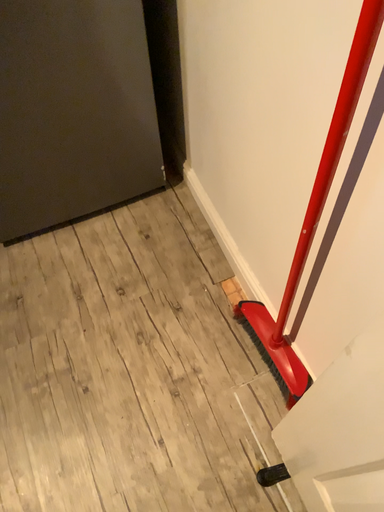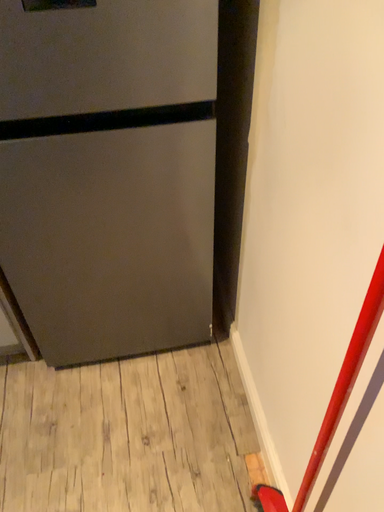
Question: Which way did the camera rotate in the video?

Choices:
 (A) rotated upward
 (B) rotated downward

Answer: (A)